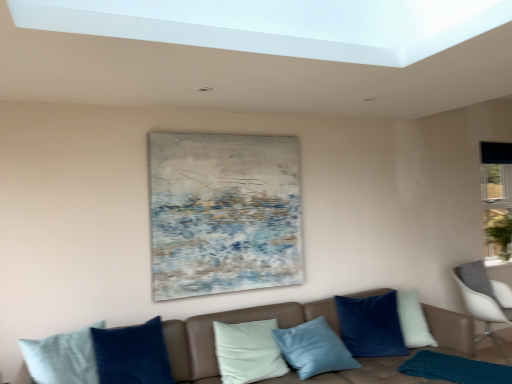
I want to click on velvet blue pillow at center, so click(x=371, y=325).

At what (x,y) coordinates should I click in order to perform the action: click on chair lying above the teal knitted mat at lower right (from the image's perspective). Please return your answer as a coordinate pair (x, y). Image resolution: width=512 pixels, height=384 pixels. Looking at the image, I should click on (485, 299).

Considering the relative sizes of white plastic chair at right and teal knitted mat at lower right in the image provided, is white plastic chair at right shorter than teal knitted mat at lower right?

No, white plastic chair at right is not shorter than teal knitted mat at lower right.

Are white plastic chair at right and teal knitted mat at lower right far apart?

Indeed, white plastic chair at right is not near teal knitted mat at lower right.

From a real-world perspective, which is physically below, white plastic chair at right or teal knitted mat at lower right?

teal knitted mat at lower right, from a real-world perspective.

Consider the image. From the image's perspective, which is below, brown leather couch at lower center or textured canvas painting at upper center?

brown leather couch at lower center.

Does brown leather couch at lower center come behind textured canvas painting at upper center?

No, it is not.

Is brown leather couch at lower center to the left of textured canvas painting at upper center from the viewer's perspective?

No.

From the image's perspective, which is below, teal knitted mat at lower right or brown leather couch at lower center?

teal knitted mat at lower right.

Is teal knitted mat at lower right far away from brown leather couch at lower center?

teal knitted mat at lower right is near brown leather couch at lower center, not far away.

Which object is further away from the camera taking this photo, teal knitted mat at lower right or brown leather couch at lower center?

Positioned behind is teal knitted mat at lower right.

Is teal knitted mat at lower right oriented away from brown leather couch at lower center?

Yes, teal knitted mat at lower right is facing away from brown leather couch at lower center.

Is point (489, 316) closer to camera compared to point (486, 264)?

That is True.

Locate an element on the screen. chair in front of the white glossy window sill at lower right is located at coordinates (485, 299).

From a real-world perspective, is white plastic chair at right positioned under white glossy window sill at lower right based on gravity?

Yes, from a real-world perspective, white plastic chair at right is under white glossy window sill at lower right.

In terms of width, does white plastic chair at right look wider or thinner when compared to white glossy window sill at lower right?

Considering their sizes, white plastic chair at right looks broader than white glossy window sill at lower right.

Is brown leather couch at lower center located outside velvet blue pillow at center?

brown leather couch at lower center is positioned outside velvet blue pillow at center.

Between brown leather couch at lower center and velvet blue pillow at center, which one is positioned behind?

velvet blue pillow at center.

Are brown leather couch at lower center and velvet blue pillow at center located far from each other?

No, brown leather couch at lower center is in close proximity to velvet blue pillow at center.

Is textured canvas painting at upper center far away from brown leather couch at lower center?

They are positioned close to each other.

Is brown leather couch at lower center at the back of textured canvas painting at upper center?

No, textured canvas painting at upper center is not facing away from brown leather couch at lower center.

Is textured canvas painting at upper center spatially inside brown leather couch at lower center, or outside of it?

textured canvas painting at upper center is not inside brown leather couch at lower center, it's outside.

How far apart are textured canvas painting at upper center and brown leather couch at lower center?

A distance of 27.02 inches exists between textured canvas painting at upper center and brown leather couch at lower center.

Looking at this image, is brown leather couch at lower center bigger than teal knitted mat at lower right?

Yes.

From the picture: Which object is more forward, brown leather couch at lower center or teal knitted mat at lower right?

brown leather couch at lower center is in front.

The image size is (512, 384). What are the coordinates of `chair above the teal knitted mat at lower right (from a real-world perspective)` in the screenshot? It's located at (485, 299).

Identify the location of studio couch below the textured canvas painting at upper center (from the image's perspective). (230, 323).

Looking at the image, which one is located further to brown leather couch at lower center, velvet blue pillow at center or white glossy window sill at lower right?

white glossy window sill at lower right is positioned further to the anchor brown leather couch at lower center.

Which object lies further to the anchor point velvet blue pillow at center, brown leather couch at lower center or teal knitted mat at lower right?

teal knitted mat at lower right is further to velvet blue pillow at center.

Based on their spatial positions, is velvet blue pillow at center or teal knitted mat at lower right closer to white plastic chair at right?

velvet blue pillow at center.

Looking at the image, which one is located closer to teal knitted mat at lower right, white plastic chair at right or velvet blue pillow at center?

The object closer to teal knitted mat at lower right is velvet blue pillow at center.

From the image, which object appears to be farther from white plastic chair at right, velvet blue pillow at center or brown leather couch at lower center?

brown leather couch at lower center is further to white plastic chair at right.

Looking at the image, which one is located closer to white plastic chair at right, velvet blue pillow at center or textured canvas painting at upper center?

velvet blue pillow at center is closer to white plastic chair at right.

Looking at the image, which one is located closer to white plastic chair at right, teal knitted mat at lower right or textured canvas painting at upper center?

Among the two, teal knitted mat at lower right is located nearer to white plastic chair at right.

Which object lies nearer to the anchor point brown leather couch at lower center, textured canvas painting at upper center or teal knitted mat at lower right?

textured canvas painting at upper center is closer to brown leather couch at lower center.

Locate an element on the screen. This screenshot has height=384, width=512. mat located between brown leather couch at lower center and white plastic chair at right in the depth direction is located at coordinates (455, 369).

Identify the location of chair between teal knitted mat at lower right and white glossy window sill at lower right from front to back. coord(485,299).

Identify the location of mat located between brown leather couch at lower center and white glossy window sill at lower right in the depth direction. The image size is (512, 384). (455, 369).

At what (x,y) coordinates should I click in order to perform the action: click on chair between textured canvas painting at upper center and white glossy window sill at lower right in the horizontal direction. Please return your answer as a coordinate pair (x, y). The width and height of the screenshot is (512, 384). Looking at the image, I should click on (485, 299).